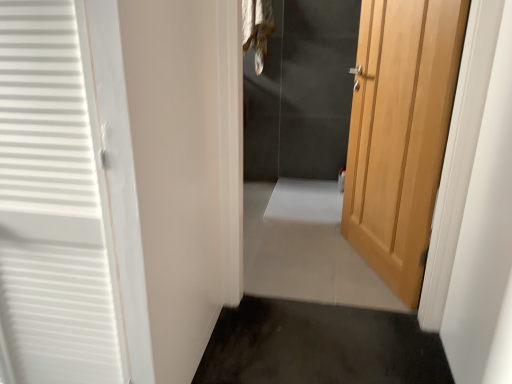
Question: In which direction should I rotate to look at white tile floor at center, which appears as the 2th path when ordered from the bottom?

Choices:
 (A) left
 (B) right

Answer: (B)

Question: From a real-world perspective, is white tile floor at center, which appears as the 2th path when ordered from the bottom, located beneath fur-like fabric at upper center?

Choices:
 (A) no
 (B) yes

Answer: (B)

Question: Can you confirm if white tile floor at center, the 1th path when ordered from back to front, is positioned to the right of fur-like fabric at upper center?

Choices:
 (A) no
 (B) yes

Answer: (B)

Question: Would you say white tile floor at center, the 1th path when ordered from back to front, is outside fur-like fabric at upper center?

Choices:
 (A) yes
 (B) no

Answer: (A)

Question: Can you confirm if white tile floor at center, which appears as the 2th path when ordered from the bottom, is smaller than fur-like fabric at upper center?

Choices:
 (A) no
 (B) yes

Answer: (A)

Question: Does white tile floor at center, arranged as the 1th path when viewed from the top, have a larger size compared to fur-like fabric at upper center?

Choices:
 (A) yes
 (B) no

Answer: (A)

Question: From the image's perspective, does white tile floor at center, the 2th path viewed from the front, appear higher than fur-like fabric at upper center?

Choices:
 (A) yes
 (B) no

Answer: (B)

Question: Can you confirm if fur-like fabric at upper center is wider than dark gray carpet at lower center, the first path from the bottom?

Choices:
 (A) yes
 (B) no

Answer: (B)

Question: Does fur-like fabric at upper center have a lesser width compared to dark gray carpet at lower center, the first path from the front?

Choices:
 (A) yes
 (B) no

Answer: (A)

Question: Is fur-like fabric at upper center beside dark gray carpet at lower center, the first path from the front?

Choices:
 (A) yes
 (B) no

Answer: (B)

Question: Can you confirm if fur-like fabric at upper center is taller than dark gray carpet at lower center, which ranks as the 2th path in top-to-bottom order?

Choices:
 (A) no
 (B) yes

Answer: (B)

Question: Considering the relative positions of fur-like fabric at upper center and dark gray carpet at lower center, the first path from the front, in the image provided, is fur-like fabric at upper center to the left of dark gray carpet at lower center, the first path from the front, from the viewer's perspective?

Choices:
 (A) no
 (B) yes

Answer: (B)

Question: Is fur-like fabric at upper center located outside dark gray carpet at lower center, which ranks as the 2th path in top-to-bottom order?

Choices:
 (A) yes
 (B) no

Answer: (A)

Question: From the image's perspective, is dark gray carpet at lower center, the first path from the bottom, located above fur-like fabric at upper center?

Choices:
 (A) yes
 (B) no

Answer: (B)